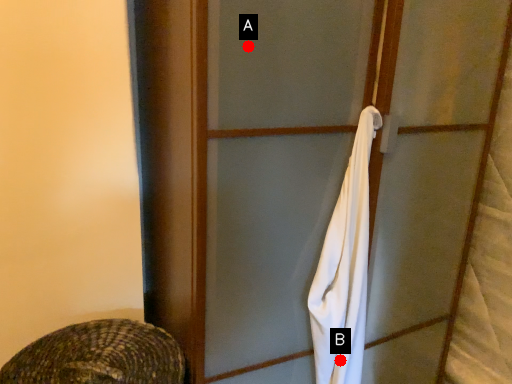
Question: Two points are circled on the image, labeled by A and B beside each circle. Which point is closer to the camera taking this photo?

Choices:
 (A) A is closer
 (B) B is closer

Answer: (A)